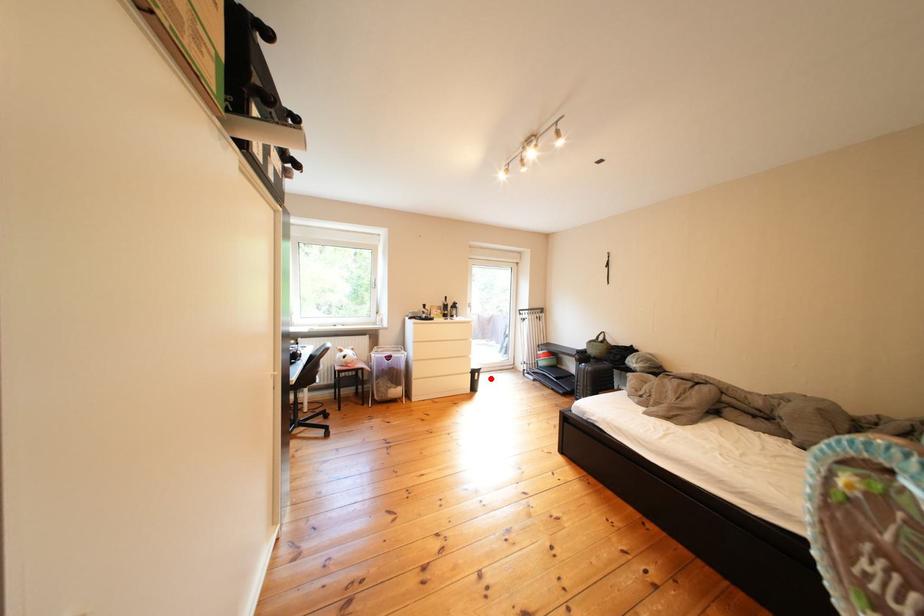
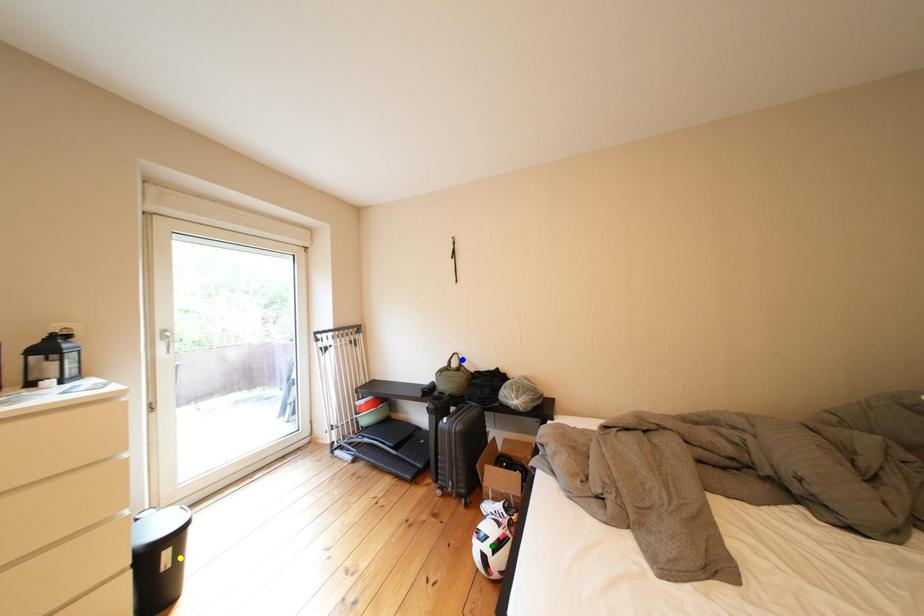
Question: I am providing you with two images of the same scene from different viewpoints. A red point is marked on the first image. You are given multiple points on the second image. Can you choose the point in image 2 that corresponds to the point in image 1?

Choices:
 (A) yellow point
 (B) blue point
 (C) green point

Answer: (A)